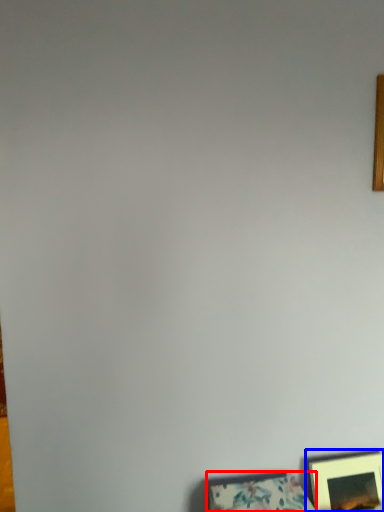
Question: Which object appears farthest to the camera in this image, picture frame (highlighted by a red box) or picture frame (highlighted by a blue box)?

Choices:
 (A) picture frame
 (B) picture frame

Answer: (B)